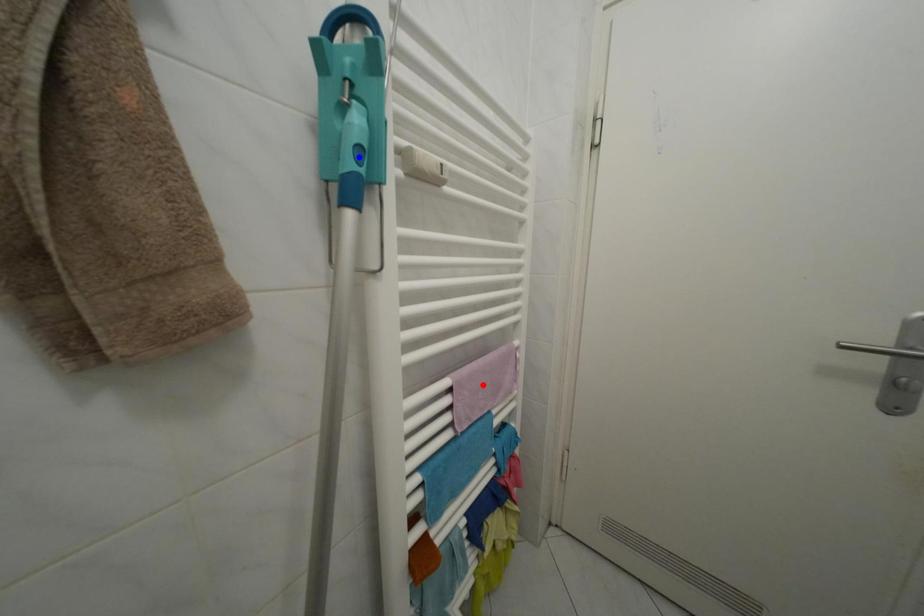
Question: Which of the two points in the image is closer to the camera?

Choices:
 (A) Blue point is closer.
 (B) Red point is closer.

Answer: (A)